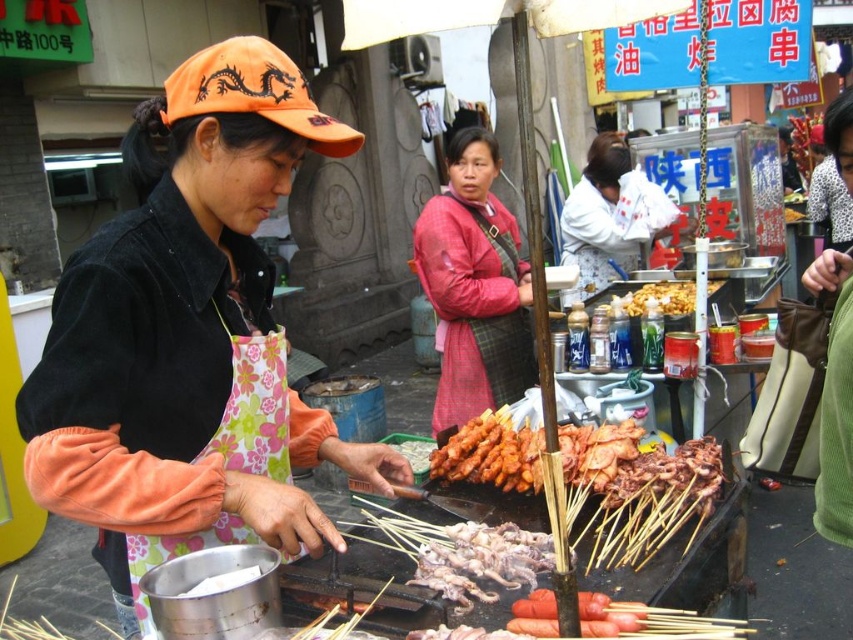
Question: Which is nearer to the pink fabric apron at center?

Choices:
 (A) orange fabric apron at center
 (B) white cotton shirt at center
 (C) brownish matte skewers at center

Answer: (B)

Question: Is orange fabric apron at center to the right of golden crispy fried chicken at center from the viewer's perspective?

Choices:
 (A) yes
 (B) no

Answer: (B)

Question: Does orange fabric apron at center have a greater width compared to brownish matte skewers at center?

Choices:
 (A) no
 (B) yes

Answer: (B)

Question: Which point is closer to the camera taking this photo?

Choices:
 (A) (532, 374)
 (B) (160, 125)

Answer: (B)

Question: Which point appears farthest from the camera in this image?

Choices:
 (A) (693, 285)
 (B) (523, 548)

Answer: (A)

Question: From the image, what is the correct spatial relationship of pink fabric apron at center in relation to white cotton shirt at center?

Choices:
 (A) right
 (B) left

Answer: (B)